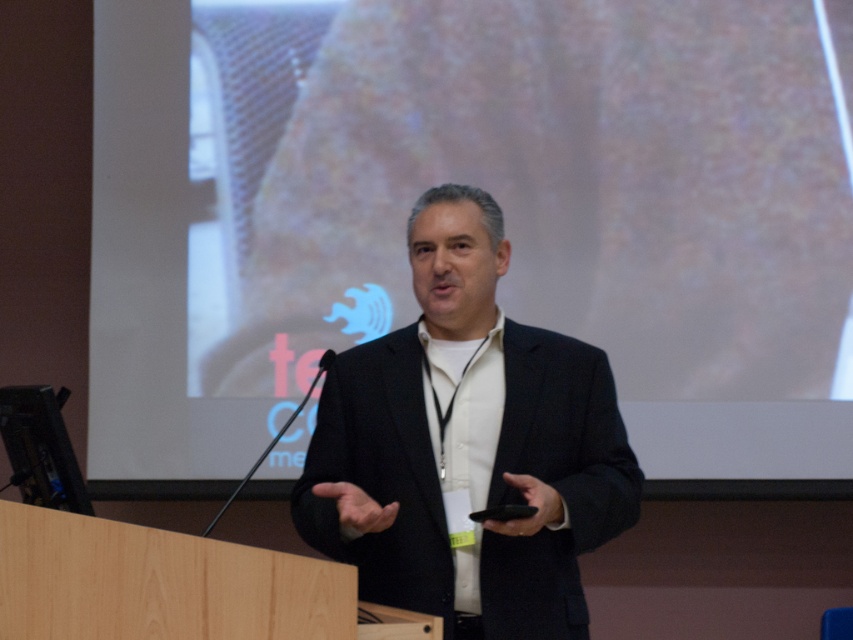
You are an attendee at a conference. You want to take a photo of the black matte suit at center without the white matte projection screen at upper center appearing in the frame. Is this possible?

The black matte suit at center is behind the white matte projection screen at upper center, so it is not possible to take a photo of the black matte suit at center without the white matte projection screen at upper center appearing in the frame.

You are an event organizer setting up a conference room. You need to ensure that the white matte projection screen at upper center is positioned so that it is wider than the black matte suit at center. Based on the scene description, can you confirm if this requirement is currently met?

The white matte projection screen at upper center might be wider than black matte suit at center, so it is possible that the requirement is met. However, the description is uncertain, so further measurement is needed to confirm.